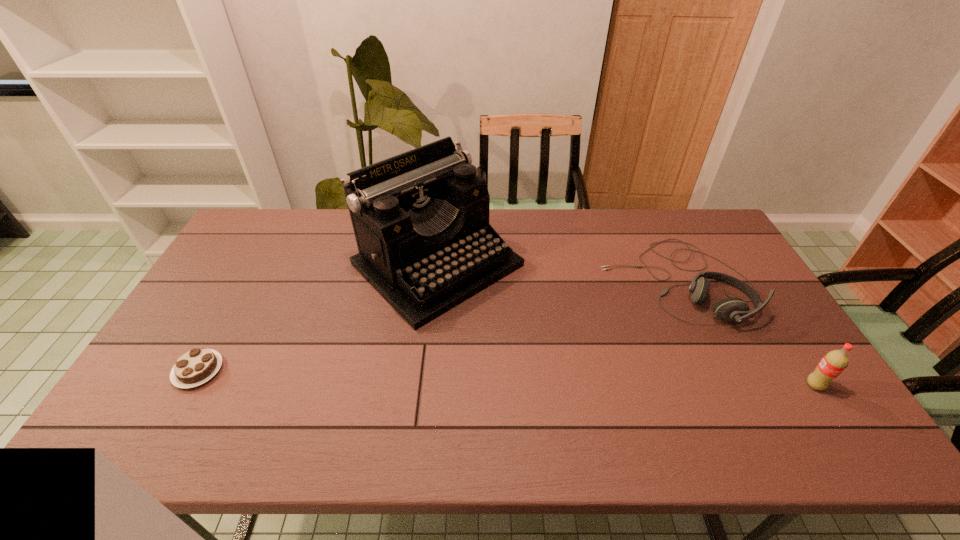
Locate an element on the screen. This screenshot has width=960, height=540. free spot located 0.120m on the outer surface of the third tallest object is located at coordinates (600, 328).

Locate an element on the screen. free space located 0.360m on the typing side of the second object from left to right is located at coordinates [x=591, y=395].

Locate an element on the screen. This screenshot has width=960, height=540. free location located on the typing side of the second object from left to right is located at coordinates (573, 379).

You are a GUI agent. You are given a task and a screenshot of the screen. Output one action in this format:
    pyautogui.click(x=<x>, y=<y>)
    Task: Click on the vacant space located 0.380m on the typing side of the second object from left to right
    The width and height of the screenshot is (960, 540).
    Given the screenshot: What is the action you would take?
    pyautogui.click(x=598, y=400)

Identify the location of headset that is at the far edge. This screenshot has height=540, width=960. (728, 309).

Where is `typewriter that is at the far edge`? This screenshot has width=960, height=540. typewriter that is at the far edge is located at coordinates (421, 218).

Where is `chocolate cake that is at the near edge`? This screenshot has width=960, height=540. chocolate cake that is at the near edge is located at coordinates (197, 366).

This screenshot has width=960, height=540. Identify the location of soda at the near edge. (834, 362).

The image size is (960, 540). I want to click on object present at the left edge, so click(197, 366).

Where is `soda that is positioned at the right edge`? Image resolution: width=960 pixels, height=540 pixels. soda that is positioned at the right edge is located at coordinates (834, 362).